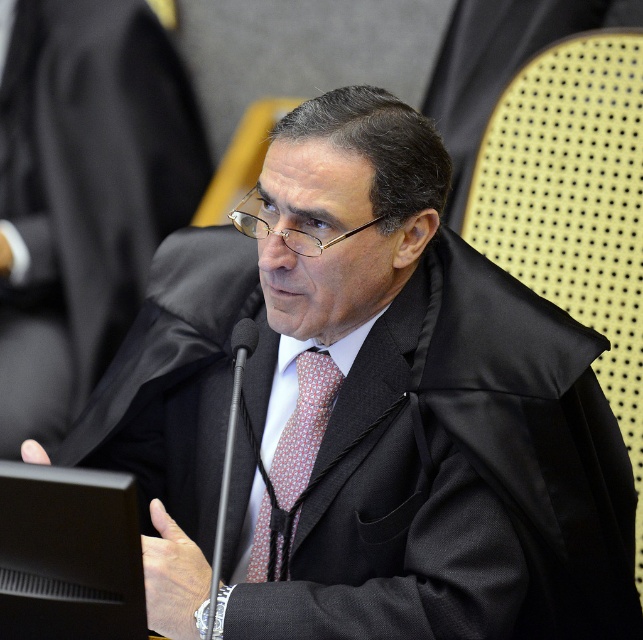
Question: Is the position of black satin robe at center more distant than that of red dotted tie at center?

Choices:
 (A) yes
 (B) no

Answer: (A)

Question: Does black satin robe at center have a lesser width compared to red dotted tie at center?

Choices:
 (A) yes
 (B) no

Answer: (B)

Question: Which of the following is the closest to the observer?

Choices:
 (A) (30, 180)
 (B) (271, 460)

Answer: (B)

Question: Does red dotted tie at center have a greater width compared to black plastic microphone at center?

Choices:
 (A) yes
 (B) no

Answer: (A)

Question: Among these objects, which one is nearest to the camera?

Choices:
 (A) black satin robe at center
 (B) red dotted tie at center

Answer: (B)

Question: Which point appears farthest from the camera in this image?

Choices:
 (A) (242, 328)
 (B) (15, 326)

Answer: (B)